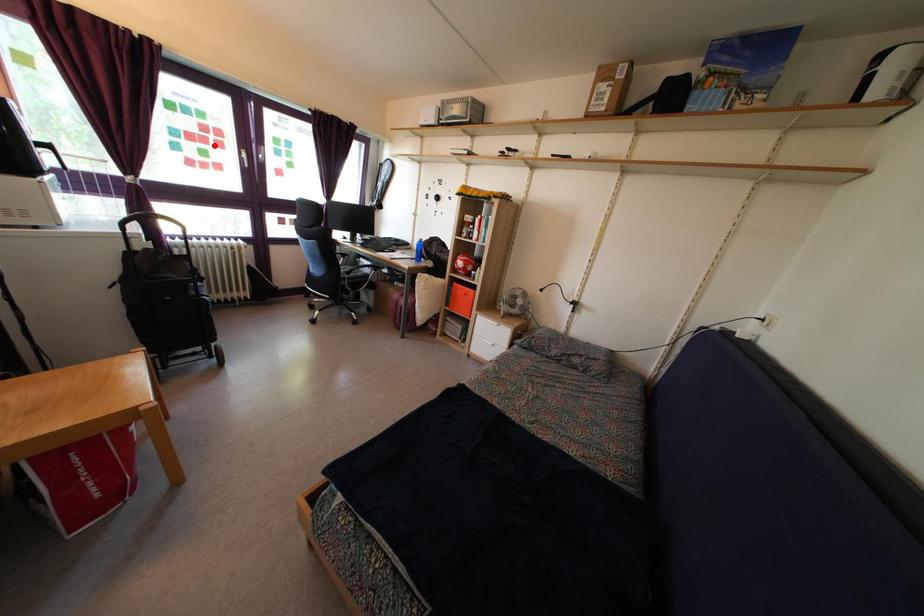
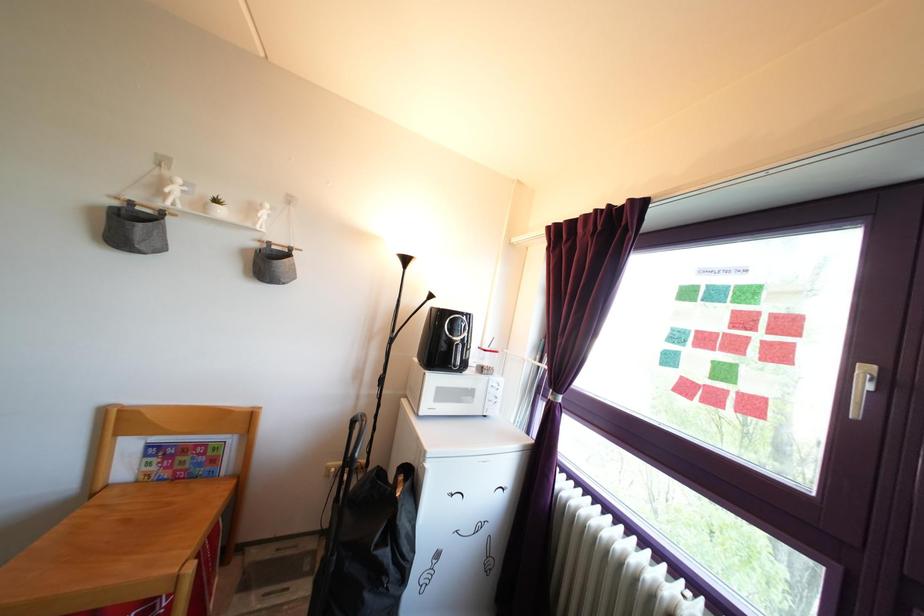
The point at the highlighted location is marked in the first image. Where is the corresponding point in the second image?

(761, 345)